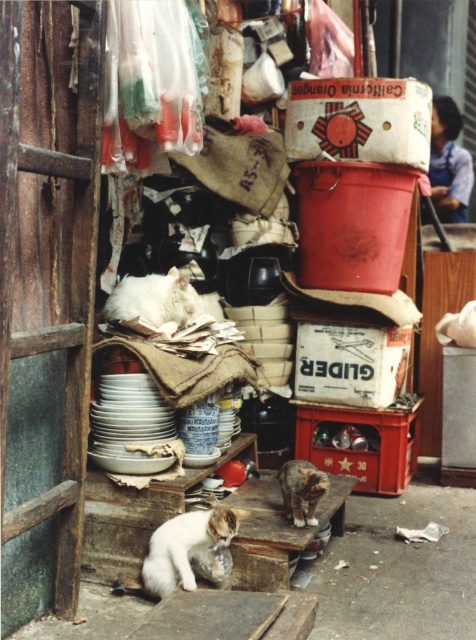
Question: Which object is positioned farthest from the white fluffy cat at center?

Choices:
 (A) tabby fur cat at lower center
 (B) white fluffy cat at lower left

Answer: (B)

Question: Which point is closer to the camera taking this photo?

Choices:
 (A) (283, 486)
 (B) (115, 305)

Answer: (A)

Question: Can you confirm if white fluffy cat at lower left is bigger than tabby fur cat at lower center?

Choices:
 (A) no
 (B) yes

Answer: (B)

Question: Where is white fluffy cat at center located in relation to tabby fur cat at lower center in the image?

Choices:
 (A) right
 (B) left

Answer: (B)

Question: Which object appears farthest from the camera in this image?

Choices:
 (A) tabby fur cat at lower center
 (B) white fluffy cat at center
 (C) white fluffy cat at lower left

Answer: (B)

Question: Does white fluffy cat at lower left have a greater width compared to white fluffy cat at center?

Choices:
 (A) yes
 (B) no

Answer: (B)